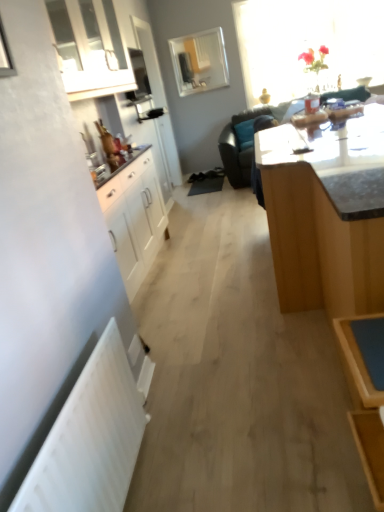
Question: Is light brown wooden table at center far from white glossy cabinet at upper left?

Choices:
 (A) yes
 (B) no

Answer: (A)

Question: Can you confirm if light brown wooden table at center is positioned to the right of white glossy cabinet at upper left?

Choices:
 (A) yes
 (B) no

Answer: (A)

Question: Is light brown wooden table at center turned away from white glossy cabinet at upper left?

Choices:
 (A) no
 (B) yes

Answer: (A)

Question: From a real-world perspective, is light brown wooden table at center under white glossy cabinet at upper left?

Choices:
 (A) yes
 (B) no

Answer: (A)

Question: Can you confirm if light brown wooden table at center is shorter than white glossy cabinet at upper left?

Choices:
 (A) yes
 (B) no

Answer: (B)

Question: From a real-world perspective, is light brown wooden table at center physically above white glossy cabinet at upper left?

Choices:
 (A) no
 (B) yes

Answer: (A)

Question: From a real-world perspective, is black leather couch at upper center on top of translucent glass vase at upper right, marked as the first window in a right-to-left arrangement?

Choices:
 (A) yes
 (B) no

Answer: (B)

Question: Does black leather couch at upper center have a greater height compared to translucent glass vase at upper right, marked as the first window in a right-to-left arrangement?

Choices:
 (A) yes
 (B) no

Answer: (B)

Question: Is black leather couch at upper center to the right of translucent glass vase at upper right, positioned as the 2th window in left-to-right order, from the viewer's perspective?

Choices:
 (A) no
 (B) yes

Answer: (A)

Question: Does black leather couch at upper center contain translucent glass vase at upper right, marked as the first window in a right-to-left arrangement?

Choices:
 (A) no
 (B) yes

Answer: (A)

Question: From a real-world perspective, is black leather couch at upper center physically below translucent glass vase at upper right, marked as the first window in a right-to-left arrangement?

Choices:
 (A) yes
 (B) no

Answer: (A)

Question: From the image's perspective, would you say black leather couch at upper center is shown under translucent glass vase at upper right, positioned as the 2th window in left-to-right order?

Choices:
 (A) no
 (B) yes

Answer: (B)

Question: Is white glossy cabinet at upper left wider than translucent glass vase at upper right, marked as the first window in a right-to-left arrangement?

Choices:
 (A) yes
 (B) no

Answer: (B)